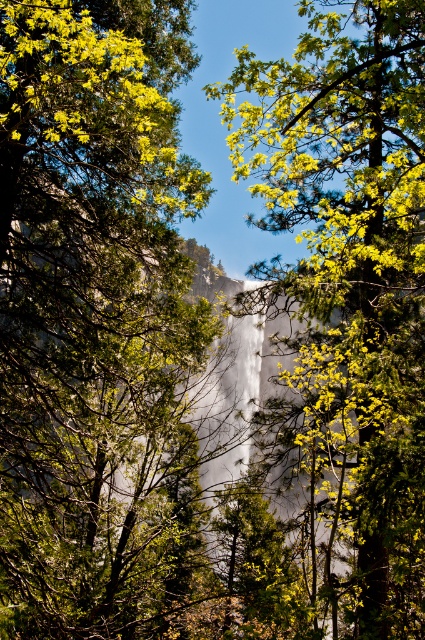
You are a hiker carrying a 2.5 meter long telescopic pole. You want to set up a tent between the green matte tree at upper left and the green leafy tree at center. Can you fit the pole horizontally between them without bending it?

The distance between the green matte tree at upper left and the green leafy tree at center is 2.60 meters. Since the pole is 2.5 meters long, it can fit horizontally between them without bending.

You are a hiker standing at the base of the waterfall and want to take a photo of both the green matte tree at upper left and the green leafy tree at center. Which tree should you move closer to in order to capture both in the same frame?

You should move closer to the green leafy tree at center because the green matte tree at upper left is closer to you already, so adjusting your position near the farther tree will help include both in the frame.

You are a hiker who wants to take a photo of the waterfall in the background. You notice the green matte tree at upper left and the green leafy tree at center blocking your view. Which tree should you move to the right to get a clearer shot of the waterfall?

You should move the green matte tree at upper left to the right since it is positioned on the left side of the green leafy tree at center and is blocking the view. Moving it right would shift it away from the center, allowing a clearer view of the waterfall.